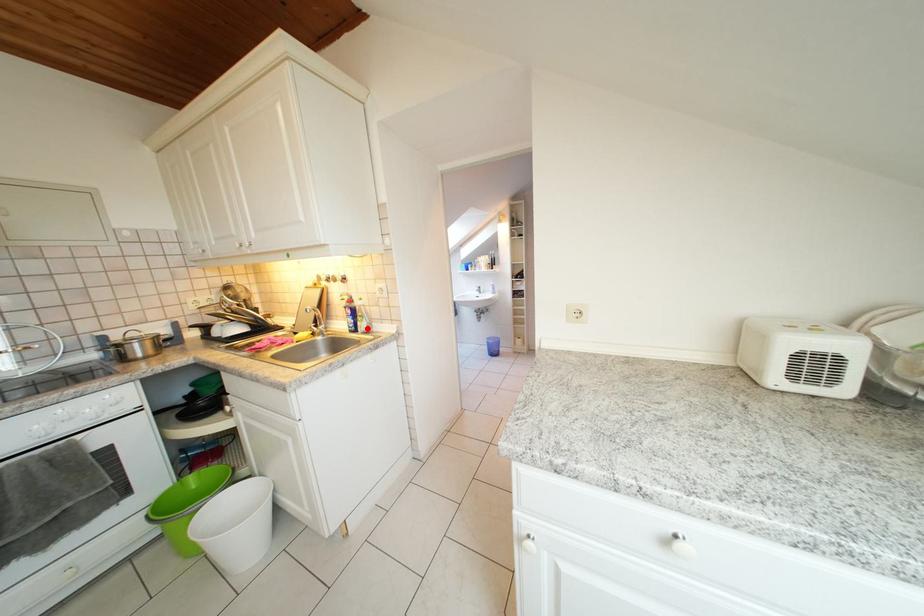
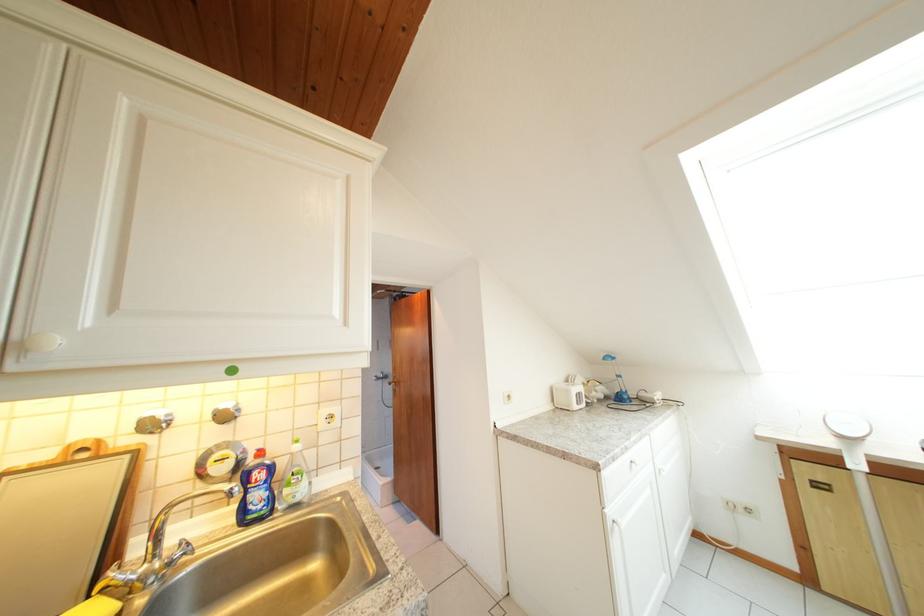
In the second image, find the point that corresponds to the highlighted location in the first image.

(295, 496)